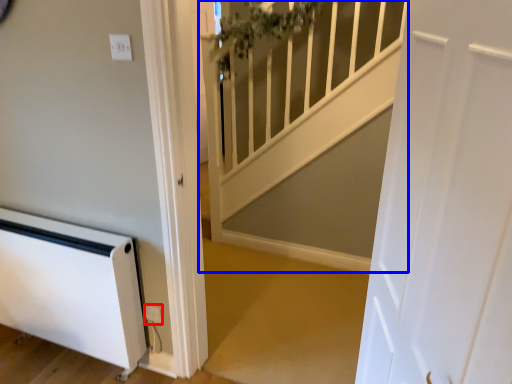
Question: Among these objects, which one is nearest to the camera, electric outlet (highlighted by a red box) or stairwell (highlighted by a blue box)?

Choices:
 (A) electric outlet
 (B) stairwell

Answer: (B)